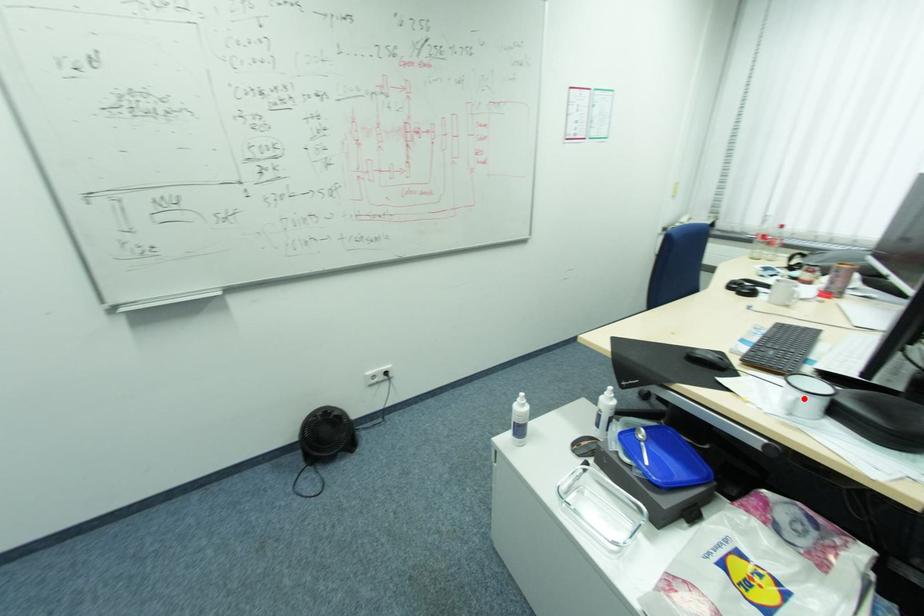
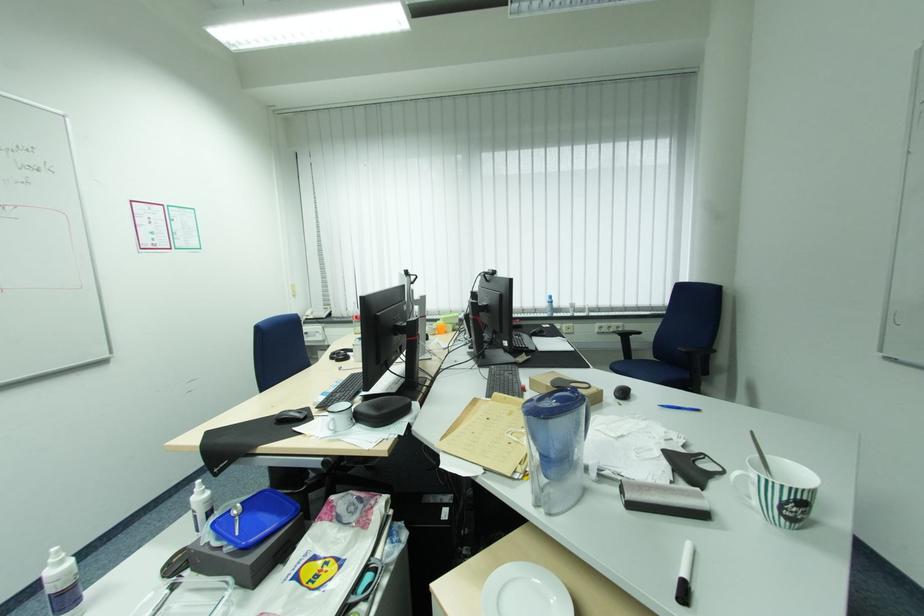
Where in the second image is the point corresponding to the highlighted location from the first image?

(339, 419)